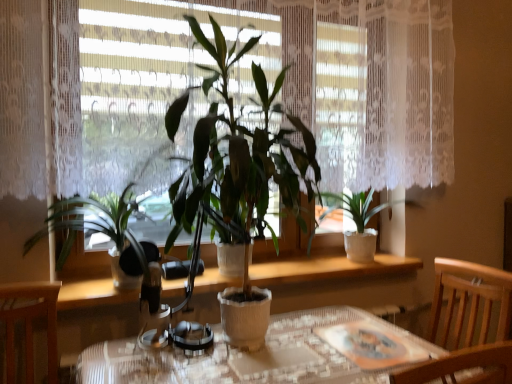
Question: Can you confirm if metallic silver headphones at center is smaller than textured glass table at center?

Choices:
 (A) yes
 (B) no

Answer: (A)

Question: Does metallic silver headphones at center have a greater width compared to textured glass table at center?

Choices:
 (A) yes
 (B) no

Answer: (B)

Question: Can you confirm if metallic silver headphones at center is bigger than textured glass table at center?

Choices:
 (A) yes
 (B) no

Answer: (B)

Question: From the image's perspective, is metallic silver headphones at center located above textured glass table at center?

Choices:
 (A) yes
 (B) no

Answer: (A)

Question: From a real-world perspective, does metallic silver headphones at center sit lower than textured glass table at center?

Choices:
 (A) yes
 (B) no

Answer: (B)

Question: Is the depth of metallic silver headphones at center less than that of textured glass table at center?

Choices:
 (A) no
 (B) yes

Answer: (A)

Question: Does metallic silver headphones at center turn towards wooden chair at lower right?

Choices:
 (A) no
 (B) yes

Answer: (A)

Question: Does metallic silver headphones at center appear on the left side of wooden chair at lower right?

Choices:
 (A) yes
 (B) no

Answer: (A)

Question: From a real-world perspective, is metallic silver headphones at center located higher than wooden chair at lower right?

Choices:
 (A) no
 (B) yes

Answer: (B)

Question: From the image's perspective, is metallic silver headphones at center located beneath wooden chair at lower right?

Choices:
 (A) yes
 (B) no

Answer: (B)

Question: From the image's perspective, is metallic silver headphones at center above wooden chair at lower right?

Choices:
 (A) yes
 (B) no

Answer: (A)

Question: Are metallic silver headphones at center and wooden chair at lower right beside each other?

Choices:
 (A) yes
 (B) no

Answer: (B)

Question: From a real-world perspective, is green matte plant at center, which is the 2th houseplant in left-to-right order, on green matte plant at center, which appears as the third houseplant when viewed from the right?

Choices:
 (A) no
 (B) yes

Answer: (B)